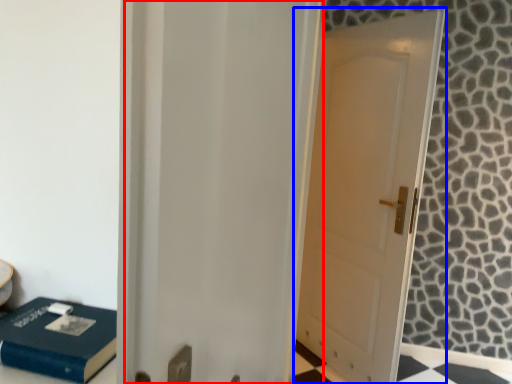
Question: Which object is further to the camera taking this photo, screen door (highlighted by a red box) or door (highlighted by a blue box)?

Choices:
 (A) screen door
 (B) door

Answer: (B)